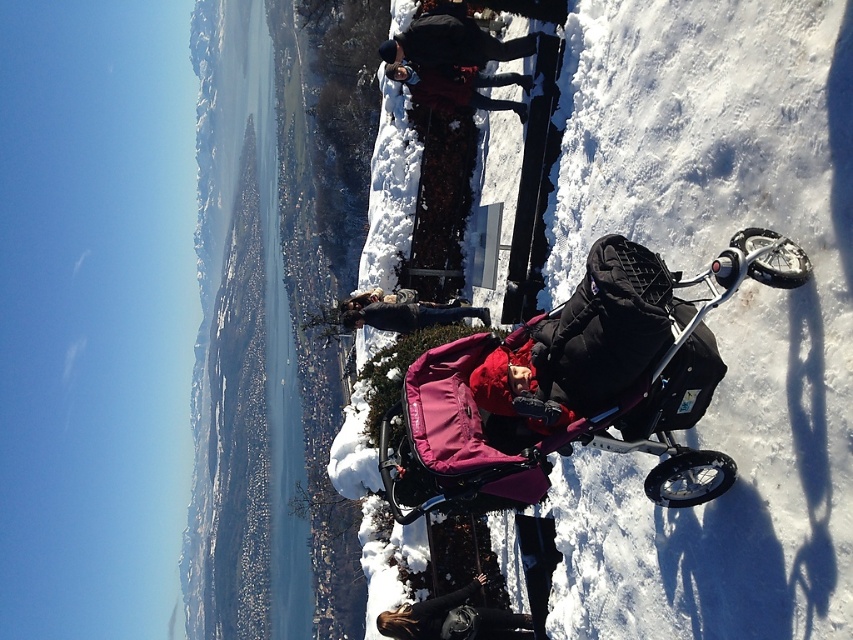
You are a photographer trying to capture a photo of the purple fabric stroller at center and the black leather jacket at lower center. Which object should you focus on first if you want to ensure both are in sharp focus, considering their heights?

The purple fabric stroller at center is not as tall as the black leather jacket at lower center, so you should focus on the taller black leather jacket at lower center first to ensure both are in sharp focus.

You are standing at the point marked by the coordinates (451, 44) in the snowy scene. What object is exactly at this location?

The dark blue jacket at upper center is located at point (451, 44).

You are a photographer trying to capture a photo of the purple fabric stroller at center and the dark blue jacket at upper center. Since you want both objects to be clearly visible in the frame, which object should you adjust your camera focus on first to ensure it appears larger in the photo?

The purple fabric stroller at center has a lesser width compared to dark blue jacket at upper center, so you should focus on the dark blue jacket at upper center first to ensure it appears larger in the photo.